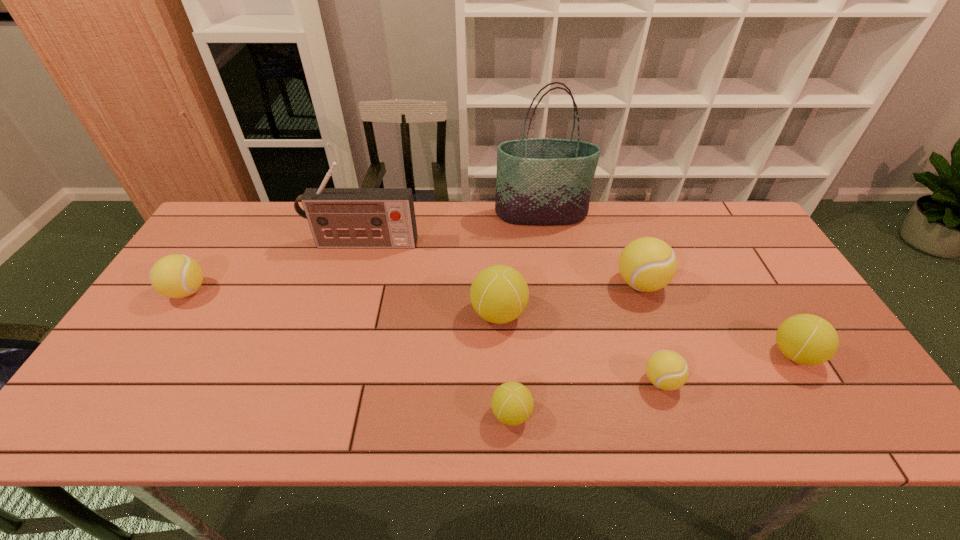
Locate an element on the screen. The height and width of the screenshot is (540, 960). the tallest object is located at coordinates (541, 181).

Find the location of a particular element. tote bag is located at coordinates (541, 181).

I want to click on radio receiver, so click(338, 217).

Locate an element on the screen. The height and width of the screenshot is (540, 960). the second object from left to right is located at coordinates (338, 217).

Locate an element on the screen. the biggest yellow tennis ball is located at coordinates (647, 264).

Where is `the biggest green tennis ball`? Image resolution: width=960 pixels, height=540 pixels. the biggest green tennis ball is located at coordinates (499, 294).

This screenshot has width=960, height=540. Find the location of `the leftmost yellow tennis ball`. the leftmost yellow tennis ball is located at coordinates (175, 276).

Locate an element on the screen. the leftmost tennis ball is located at coordinates (175, 276).

Locate an element on the screen. the rightmost tennis ball is located at coordinates (806, 339).

I want to click on the rightmost object, so click(x=806, y=339).